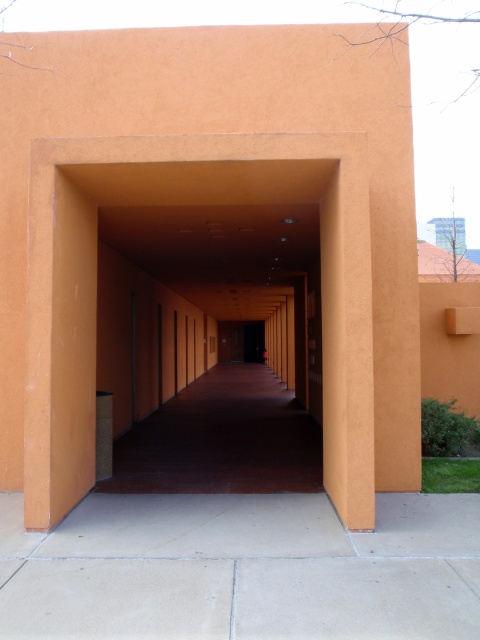
You are a maintenance worker needing to place a 5 feet long equipment between the smooth concrete pavement at center and the orange matte wall at center. Can you fit it without moving either object?

The smooth concrete pavement at center and orange matte wall at center are 4.65 feet apart, which is shorter than the 5 feet long equipment. Therefore, the equipment cannot be placed between them without moving either object.

Looking at this image, you are standing in the corridor and want to locate the orange matte wall at center. According to the coordinates provided, where should you look?

The orange matte wall at center is located at coordinates point (189, 204).

You are standing in the corridor and want to place a small potted plant between the smooth concrete pavement at center and the orange matte wall at center. Based on their positions, where should you place the plant?

The smooth concrete pavement at center is below the orange matte wall at center, so you should place the plant between them by positioning it on the pavement near the wall.